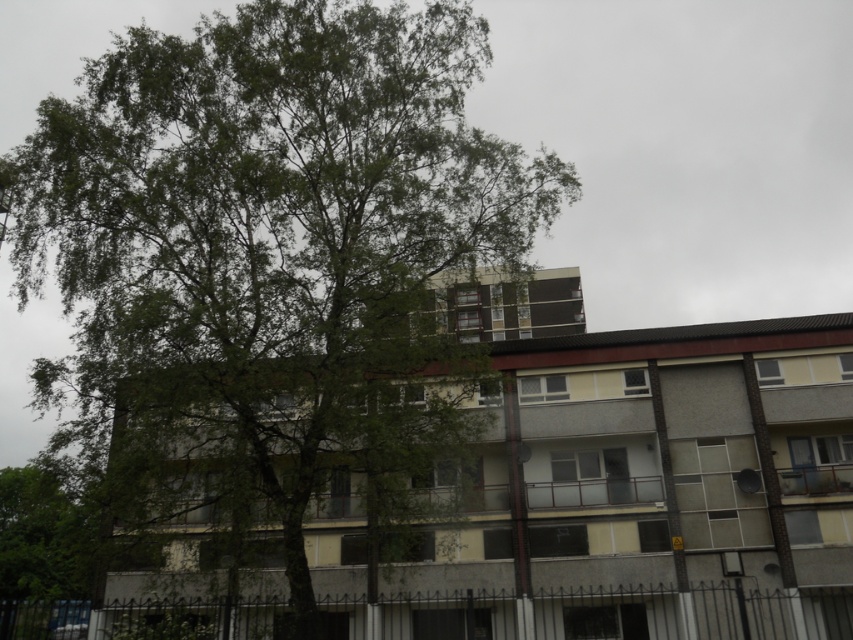
You are a bird flying over the urban scene. You want to land on the closest tree to the building. Which tree should you choose between the green leafy tree at center and the green leafy tree at lower left?

The green leafy tree at lower left is closer to the building because the green leafy tree at center is positioned over it, meaning it is farther away from the building.

You are standing in front of the residential building and notice a point marked at coordinates [271,253]. Based on the scene description, what object does this point most likely represent?

The point at coordinates [271,253] corresponds to the green leafy tree at center.

You are standing in front of the residential building and want to take a photo of the entire structure. However, there is a green leafy tree at center blocking your view. Given that the tree is 8.79 meters away from you, can you estimate whether moving backward by 5 meters would allow you to capture the entire building without the tree obstructing it?

Moving backward by 5 meters would increase the distance between you and the green leafy tree at center to 13.79 meters. However, without knowing the height and spread of the tree or the building dimensions, it is impossible to determine if the entire building will be visible. More information about the tree and building sizes is needed to make an accurate assessment.